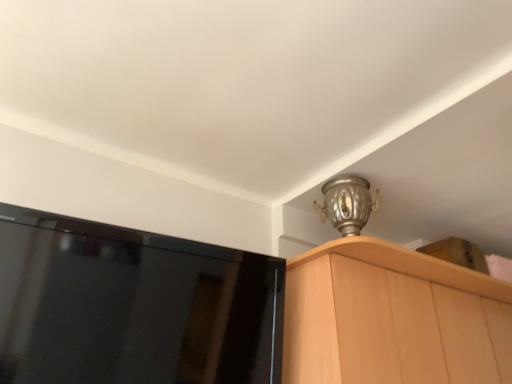
Describe the element at coordinates (133, 306) in the screenshot. The height and width of the screenshot is (384, 512). I see `black glossy screen at upper left` at that location.

Identify the location of black glossy screen at upper left. The image size is (512, 384). (133, 306).

The height and width of the screenshot is (384, 512). In order to click on light wood cabinet at upper right in this screenshot , I will do `click(392, 318)`.

Image resolution: width=512 pixels, height=384 pixels. Describe the element at coordinates (392, 318) in the screenshot. I see `light wood cabinet at upper right` at that location.

What are the coordinates of `black glossy screen at upper left` in the screenshot? It's located at (133, 306).

Which object is positioned more to the right, black glossy screen at upper left or light wood cabinet at upper right?

light wood cabinet at upper right is more to the right.

Considering their positions, is black glossy screen at upper left located in front of or behind light wood cabinet at upper right?

In the image, black glossy screen at upper left appears in front of light wood cabinet at upper right.

Which point is more forward, (200, 291) or (388, 291)?

The point (200, 291) is in front.

From the image's perspective, would you say black glossy screen at upper left is positioned over light wood cabinet at upper right?

Yes, from the image's perspective, black glossy screen at upper left is above light wood cabinet at upper right.

Consider the image. From a real-world perspective, is black glossy screen at upper left over light wood cabinet at upper right?

Incorrect, from a real-world perspective, black glossy screen at upper left is lower than light wood cabinet at upper right.

Is black glossy screen at upper left thinner than light wood cabinet at upper right?

Correct, the width of black glossy screen at upper left is less than that of light wood cabinet at upper right.

Is black glossy screen at upper left shorter than light wood cabinet at upper right?

Indeed, black glossy screen at upper left has a lesser height compared to light wood cabinet at upper right.

In terms of size, does black glossy screen at upper left appear bigger or smaller than light wood cabinet at upper right?

Considering their sizes, black glossy screen at upper left takes up less space than light wood cabinet at upper right.

Would you say black glossy screen at upper left is inside or outside light wood cabinet at upper right?

black glossy screen at upper left is outside light wood cabinet at upper right.

Is black glossy screen at upper left far away from light wood cabinet at upper right?

black glossy screen at upper left is actually quite close to light wood cabinet at upper right.

Is black glossy screen at upper left positioned with its back to light wood cabinet at upper right?

No.

This screenshot has height=384, width=512. I want to click on cabinetry behind the black glossy screen at upper left, so click(392, 318).

Does light wood cabinet at upper right appear on the left side of black glossy screen at upper left?

Incorrect, light wood cabinet at upper right is not on the left side of black glossy screen at upper left.

Is light wood cabinet at upper right positioned behind black glossy screen at upper left?

Yes, it is behind black glossy screen at upper left.

Does point (404, 309) appear closer or farther from the camera than point (264, 355)?

Point (404, 309) is farther from the camera than point (264, 355).

From the image's perspective, is light wood cabinet at upper right on top of black glossy screen at upper left?

No, from the image's perspective, light wood cabinet at upper right is not above black glossy screen at upper left.

From a real-world perspective, which is physically below, light wood cabinet at upper right or black glossy screen at upper left?

black glossy screen at upper left.

Which of these two, light wood cabinet at upper right or black glossy screen at upper left, is wider?

Wider between the two is light wood cabinet at upper right.

Which of these two, light wood cabinet at upper right or black glossy screen at upper left, stands taller?

light wood cabinet at upper right.

In terms of size, does light wood cabinet at upper right appear bigger or smaller than black glossy screen at upper left?

In the image, light wood cabinet at upper right appears to be larger than black glossy screen at upper left.

Can we say light wood cabinet at upper right lies outside black glossy screen at upper left?

Indeed, light wood cabinet at upper right is completely outside black glossy screen at upper left.

Does light wood cabinet at upper right touch black glossy screen at upper left?

No, light wood cabinet at upper right is not touching black glossy screen at upper left.

Could you tell me if light wood cabinet at upper right is turned towards black glossy screen at upper left?

No, light wood cabinet at upper right is not oriented towards black glossy screen at upper left.

What's the angular difference between light wood cabinet at upper right and black glossy screen at upper left's facing directions?

0.177 degrees separate the facing orientations of light wood cabinet at upper right and black glossy screen at upper left.

How much distance is there between light wood cabinet at upper right and black glossy screen at upper left?

light wood cabinet at upper right and black glossy screen at upper left are 20.84 inches apart from each other.

Find the location of a particular element. This screenshot has width=512, height=384. cabinetry behind the black glossy screen at upper left is located at coordinates (392, 318).

This screenshot has height=384, width=512. In order to click on screen above the light wood cabinet at upper right (from the image's perspective) in this screenshot , I will do `click(133, 306)`.

This screenshot has height=384, width=512. I want to click on screen that appears below the light wood cabinet at upper right (from a real-world perspective), so click(x=133, y=306).